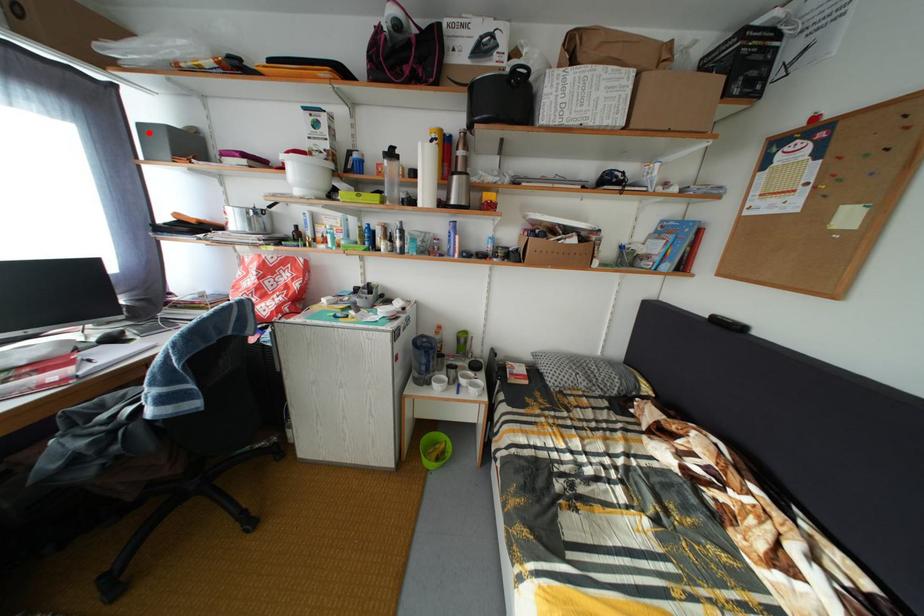
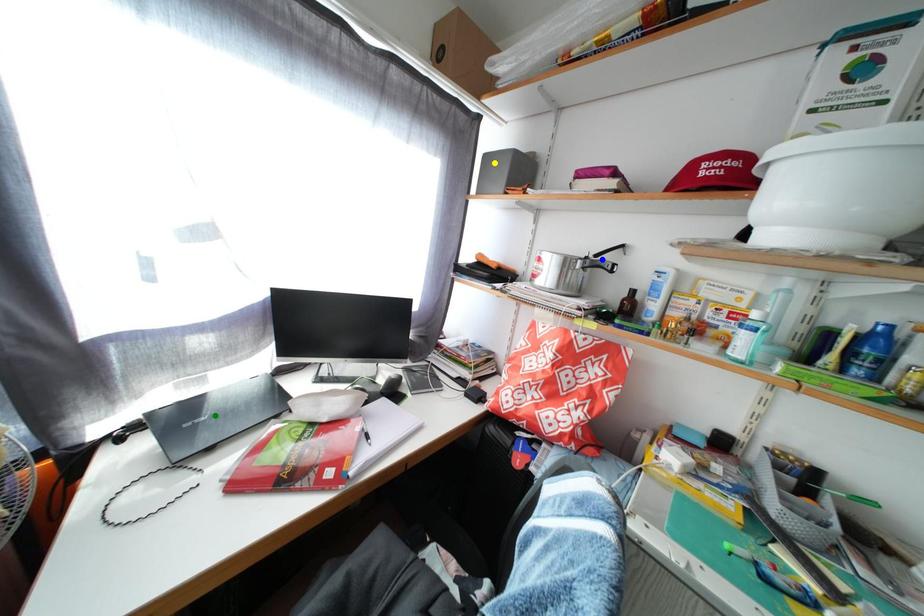
Question: I am providing you with two images of the same scene from different viewpoints. A red point is marked on the first image. You are given multiple points on the second image. Which point in image 2 represents the same 3d spot as the red point in image 1?

Choices:
 (A) green point
 (B) yellow point
 (C) blue point

Answer: (B)